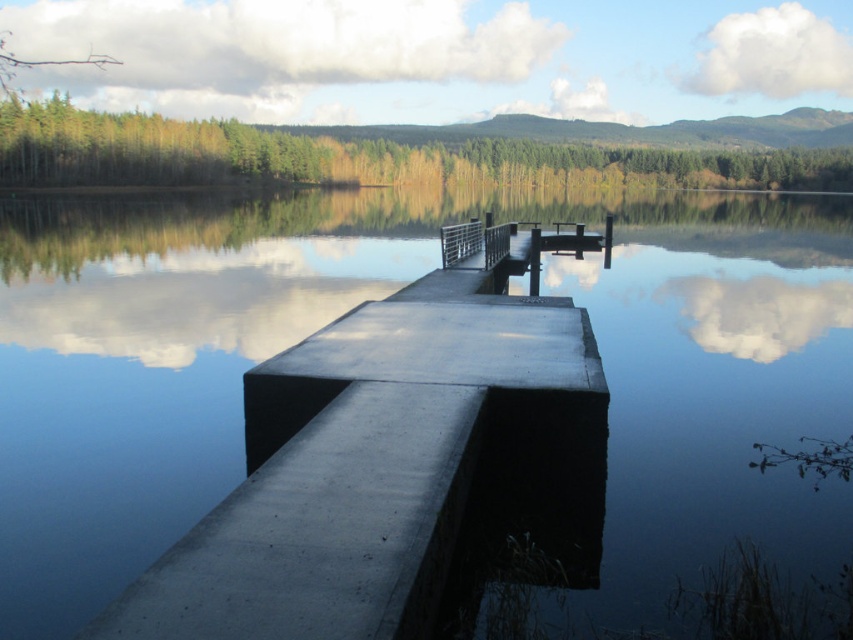
Question: Is smooth blue water at center thinner than satin silver railing at center?

Choices:
 (A) no
 (B) yes

Answer: (A)

Question: From the image, what is the correct spatial relationship of smooth blue water at center in relation to satin silver railing at center?

Choices:
 (A) below
 (B) above

Answer: (B)

Question: Is smooth blue water at center below satin silver railing at center?

Choices:
 (A) yes
 (B) no

Answer: (B)